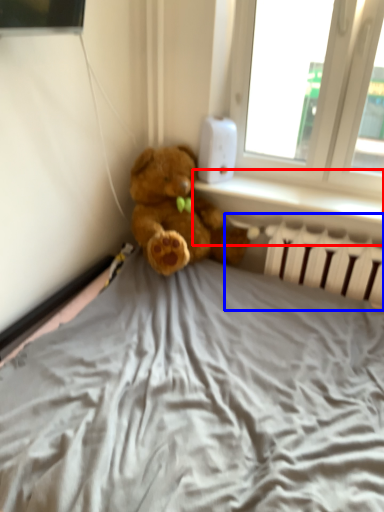
Question: Among these objects, which one is nearest to the camera, window sill (highlighted by a red box) or radiator (highlighted by a blue box)?

Choices:
 (A) window sill
 (B) radiator

Answer: (B)